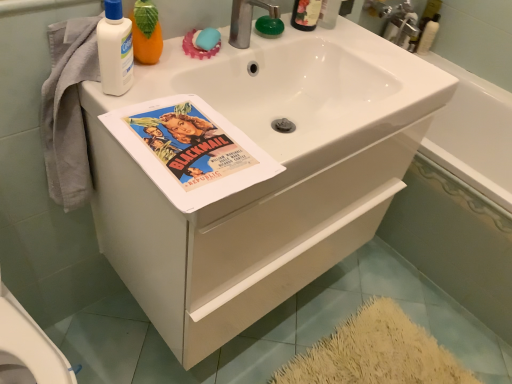
I want to click on free space that is in between matte paper poster at center and white matte lotion at upper left, positioned as the 1th cleaning product in left-to-right order, so (143, 97).